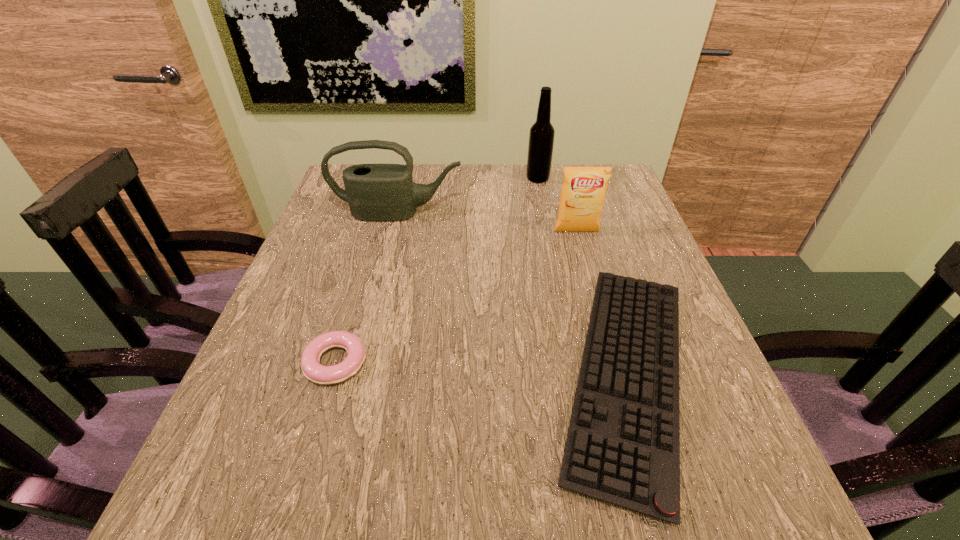
The image size is (960, 540). I want to click on free space located 0.050m on the back of the computer keyboard, so click(594, 264).

Where is `beer bottle at the far edge`? beer bottle at the far edge is located at coordinates (541, 137).

In order to click on watering can at the far edge in this screenshot , I will do `click(375, 192)`.

Locate an element on the screen. This screenshot has height=540, width=960. object that is positioned at the near edge is located at coordinates (623, 446).

Identify the location of watering can that is positioned at the left edge. This screenshot has width=960, height=540. (375, 192).

Image resolution: width=960 pixels, height=540 pixels. I want to click on doughnut that is at the left edge, so click(324, 375).

The width and height of the screenshot is (960, 540). Identify the location of crisp (potato chip) that is positioned at the right edge. (583, 192).

Identify the location of computer keyboard at the right edge. (623, 446).

Where is `object at the far left corner`? Image resolution: width=960 pixels, height=540 pixels. object at the far left corner is located at coordinates pos(375,192).

You are a GUI agent. You are given a task and a screenshot of the screen. Output one action in this format:
    pyautogui.click(x=<x>, y=<y>)
    Task: Click on the object that is at the near right corner
    
    Given the screenshot: What is the action you would take?
    pyautogui.click(x=623, y=446)